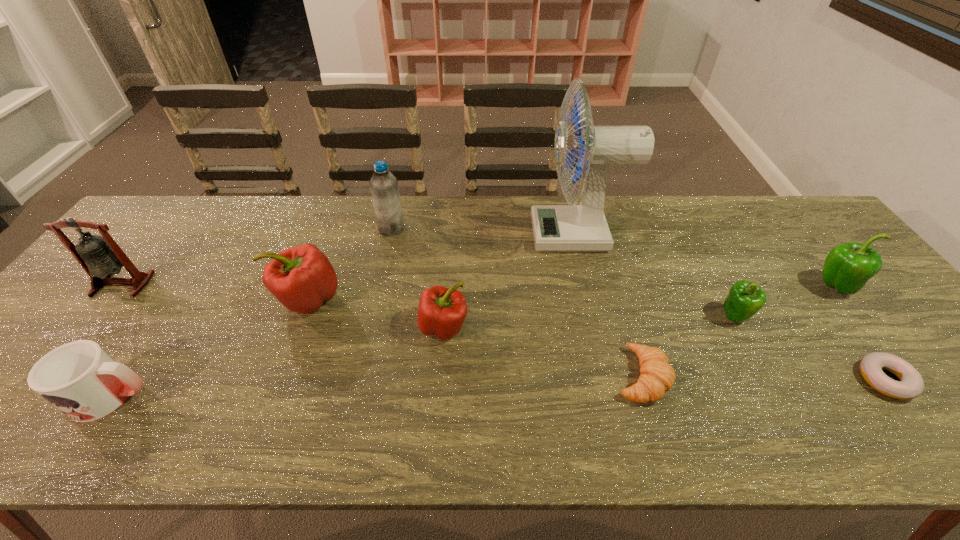
Locate an element on the screen. The height and width of the screenshot is (540, 960). the tallest object is located at coordinates (584, 227).

Locate an element on the screen. This screenshot has height=540, width=960. fan is located at coordinates (584, 227).

In order to click on the seventh object from right to left in this screenshot , I will do `click(383, 184)`.

At what (x,y) coordinates should I click in order to perform the action: click on water bottle. Please return your answer as a coordinate pair (x, y). Looking at the image, I should click on (383, 184).

Image resolution: width=960 pixels, height=540 pixels. I want to click on the leftmost object, so click(x=100, y=256).

The height and width of the screenshot is (540, 960). I want to click on the right green bell pepper, so click(848, 267).

The width and height of the screenshot is (960, 540). Find the location of `the farther green bell pepper`. the farther green bell pepper is located at coordinates (848, 267).

Identify the location of the bigger pink bell pepper. This screenshot has height=540, width=960. (301, 278).

Identify the location of the third object from left to right. Image resolution: width=960 pixels, height=540 pixels. [301, 278].

Image resolution: width=960 pixels, height=540 pixels. In order to click on the second bell pepper from right to left in this screenshot , I will do `click(745, 299)`.